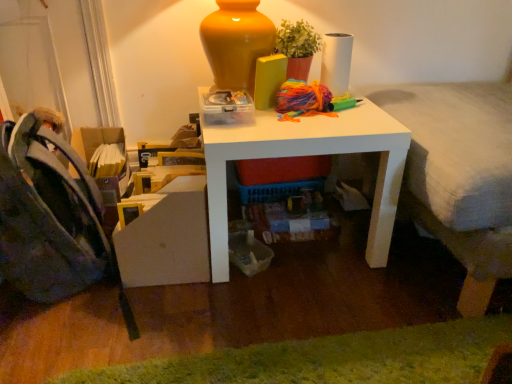
Where is `matte terracotta pot at upper center`? The image size is (512, 384). matte terracotta pot at upper center is located at coordinates (297, 47).

Find the location of a particular element. white matte table at center is located at coordinates (308, 155).

The width and height of the screenshot is (512, 384). What do you see at coordinates (48, 216) in the screenshot?
I see `dark blue fabric folding chair at left` at bounding box center [48, 216].

Locate an element on the screen. matte terracotta pot at upper center is located at coordinates (297, 47).

Which object is positioned more to the right, matte terracotta pot at upper center or dark blue fabric folding chair at left?

Positioned to the right is matte terracotta pot at upper center.

Considering the sizes of objects matte terracotta pot at upper center and dark blue fabric folding chair at left in the image provided, who is smaller, matte terracotta pot at upper center or dark blue fabric folding chair at left?

matte terracotta pot at upper center is smaller.

Could dark blue fabric folding chair at left be considered to be inside matte terracotta pot at upper center?

No, dark blue fabric folding chair at left is not a part of matte terracotta pot at upper center.

From the picture: From the image's perspective, which one is positioned lower, matte terracotta pot at upper center or dark blue fabric folding chair at left?

dark blue fabric folding chair at left appears lower in the image.

Does green fuzzy rug at lower center have a lesser height compared to white matte table at center?

Yes.

Would you say green fuzzy rug at lower center is outside white matte table at center?

Yes.

From a real-world perspective, is green fuzzy rug at lower center physically located above or below white matte table at center?

From a real-world perspective, green fuzzy rug at lower center is physically below white matte table at center.

Is green fuzzy rug at lower center far from white matte table at center?

green fuzzy rug at lower center is actually quite close to white matte table at center.

Between textured gray bed at right and green fuzzy rug at lower center, which one has larger width?

With larger width is textured gray bed at right.

Considering the relative sizes of textured gray bed at right and green fuzzy rug at lower center in the image provided, is textured gray bed at right bigger than green fuzzy rug at lower center?

Correct, textured gray bed at right is larger in size than green fuzzy rug at lower center.

Which is correct: textured gray bed at right is inside green fuzzy rug at lower center, or outside of it?

textured gray bed at right is located beyond the bounds of green fuzzy rug at lower center.

From a real-world perspective, between matte terracotta pot at upper center and green fuzzy rug at lower center, who is vertically higher?

matte terracotta pot at upper center, from a real-world perspective.

Which object is further away from the camera, matte terracotta pot at upper center or green fuzzy rug at lower center?

matte terracotta pot at upper center.

In terms of width, does matte terracotta pot at upper center look wider or thinner when compared to green fuzzy rug at lower center?

Considering their sizes, matte terracotta pot at upper center looks slimmer than green fuzzy rug at lower center.

Is white matte table at center located outside green fuzzy rug at lower center?

white matte table at center lies outside green fuzzy rug at lower center's area.

Does white matte table at center turn towards green fuzzy rug at lower center?

Yes, white matte table at center is oriented towards green fuzzy rug at lower center.

Considering the positions of points (280, 125) and (507, 318), is point (280, 125) closer to camera compared to point (507, 318)?

No, (280, 125) is further to viewer.

Is white matte table at center beside green fuzzy rug at lower center?

They are not placed beside each other.

Is green fuzzy rug at lower center surrounding matte terracotta pot at upper center?

That's incorrect, matte terracotta pot at upper center is not inside green fuzzy rug at lower center.

From a real-world perspective, who is located higher, green fuzzy rug at lower center or matte terracotta pot at upper center?

In real-world perspective, matte terracotta pot at upper center is above.

How many degrees apart are the facing directions of green fuzzy rug at lower center and matte terracotta pot at upper center?

1.66 degrees separate the facing orientations of green fuzzy rug at lower center and matte terracotta pot at upper center.

Measure the distance between green fuzzy rug at lower center and matte terracotta pot at upper center.

green fuzzy rug at lower center and matte terracotta pot at upper center are 33.70 inches apart.

Is green fuzzy rug at lower center beside dark blue fabric folding chair at left?

green fuzzy rug at lower center is not next to dark blue fabric folding chair at left, and they're not touching.

Is green fuzzy rug at lower center wider than dark blue fabric folding chair at left?

Incorrect, the width of green fuzzy rug at lower center does not surpass that of dark blue fabric folding chair at left.

Considering the points (93, 371) and (29, 292), which point is behind, point (93, 371) or point (29, 292)?

The point (29, 292) is farther.

Is green fuzzy rug at lower center to the left of dark blue fabric folding chair at left from the viewer's perspective?

No.

The width and height of the screenshot is (512, 384). What are the coordinates of `folding chair in front of the matte terracotta pot at upper center` in the screenshot? It's located at (48, 216).

Locate an element on the screen. This screenshot has width=512, height=384. mat below the white matte table at center (from a real-world perspective) is located at coordinates (330, 359).

Estimate the real-world distances between objects in this image. Which object is closer to white matte table at center, dark blue fabric folding chair at left or textured gray bed at right?

Among the two, textured gray bed at right is located nearer to white matte table at center.

From the image, which object appears to be nearer to white matte table at center, green fuzzy rug at lower center or textured gray bed at right?

textured gray bed at right is positioned closer to the anchor white matte table at center.

Estimate the real-world distances between objects in this image. Which object is further from matte terracotta pot at upper center, textured gray bed at right or white matte table at center?

textured gray bed at right.

Which object lies further to the anchor point green fuzzy rug at lower center, matte terracotta pot at upper center or dark blue fabric folding chair at left?

Among the two, matte terracotta pot at upper center is located further to green fuzzy rug at lower center.

When comparing their distances from matte terracotta pot at upper center, does dark blue fabric folding chair at left or green fuzzy rug at lower center seem closer?

dark blue fabric folding chair at left is closer to matte terracotta pot at upper center.

When comparing their distances from matte terracotta pot at upper center, does textured gray bed at right or green fuzzy rug at lower center seem closer?

The object closer to matte terracotta pot at upper center is textured gray bed at right.

Looking at the image, which one is located closer to white matte table at center, dark blue fabric folding chair at left or green fuzzy rug at lower center?

green fuzzy rug at lower center is closer to white matte table at center.

When comparing their distances from textured gray bed at right, does dark blue fabric folding chair at left or matte terracotta pot at upper center seem further?

Based on the image, dark blue fabric folding chair at left appears to be further to textured gray bed at right.

The width and height of the screenshot is (512, 384). I want to click on mat situated between dark blue fabric folding chair at left and textured gray bed at right from left to right, so click(330, 359).

Locate an element on the screen. folding chair between matte terracotta pot at upper center and green fuzzy rug at lower center vertically is located at coordinates (48, 216).

I want to click on houseplant between dark blue fabric folding chair at left and textured gray bed at right, so click(297, 47).

At what (x,y) coordinates should I click in order to perform the action: click on houseplant between white matte table at center and textured gray bed at right. Please return your answer as a coordinate pair (x, y). Looking at the image, I should click on (297, 47).